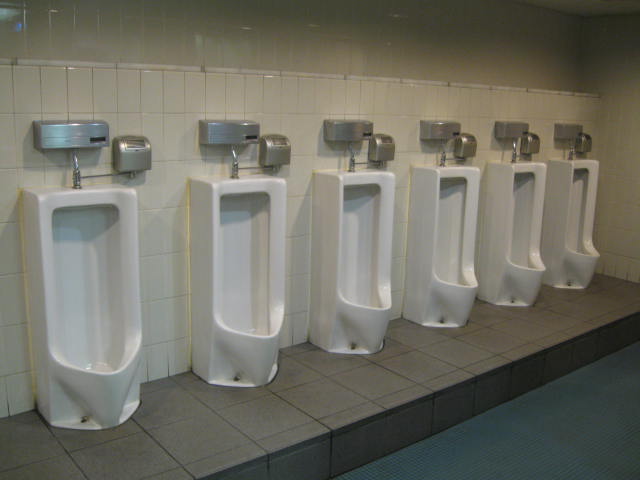
Locate an element on the screen. urinals is located at coordinates (82, 302), (265, 300), (371, 271), (438, 255), (514, 248), (578, 255).